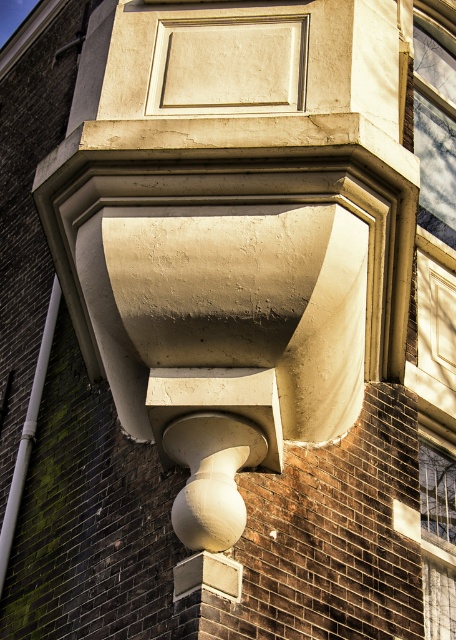
Is matte concrete balcony at center shorter than smooth glass window at upper right?

No, matte concrete balcony at center is not shorter than smooth glass window at upper right.

Does matte concrete balcony at center have a greater width compared to smooth glass window at upper right?

Correct, the width of matte concrete balcony at center exceeds that of smooth glass window at upper right.

This screenshot has width=456, height=640. Identify the location of matte concrete balcony at center. (233, 212).